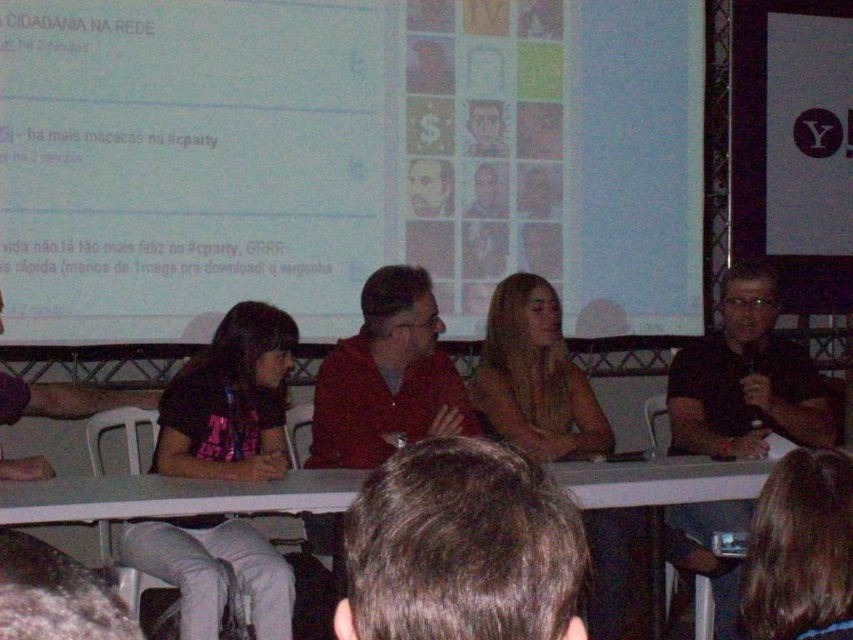
Who is more distant from viewer, (670,512) or (657,490)?

Positioned behind is point (670,512).

Between point (671, 388) and point (595, 483), which one is positioned in front?

Point (595, 483) is more forward.

This screenshot has height=640, width=853. I want to click on black matte shirt at right, so click(x=746, y=380).

Between black matte shirt at right and blonde hair at center, which one is positioned higher?

Positioned higher is blonde hair at center.

Which is behind, point (727, 397) or point (611, 596)?

The point (727, 397) is more distant.

I want to click on black matte shirt at right, so click(x=746, y=380).

Is matte red sweater at center taller than brown hair at upper center?

Indeed, matte red sweater at center has a greater height compared to brown hair at upper center.

Find the location of a particular element. matte red sweater at center is located at coordinates (387, 378).